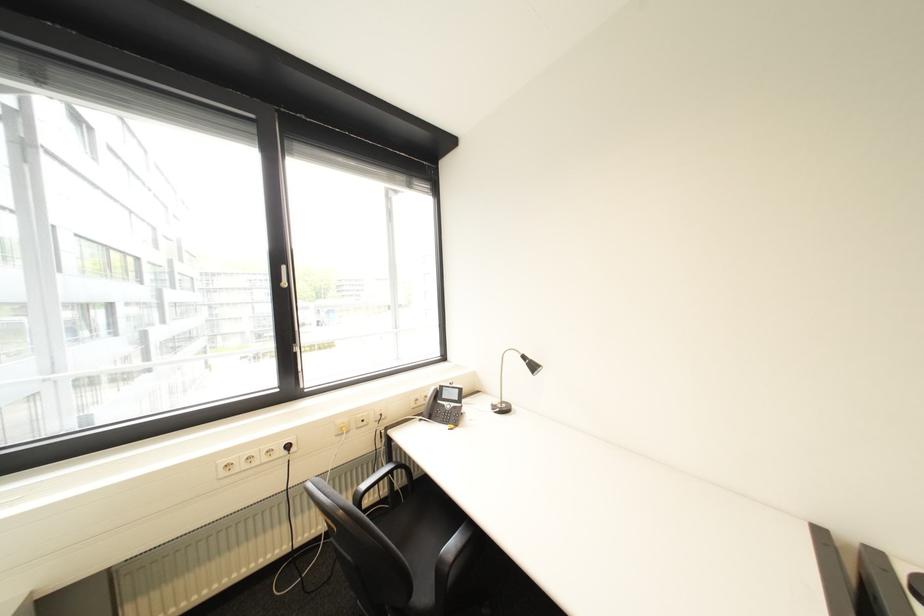
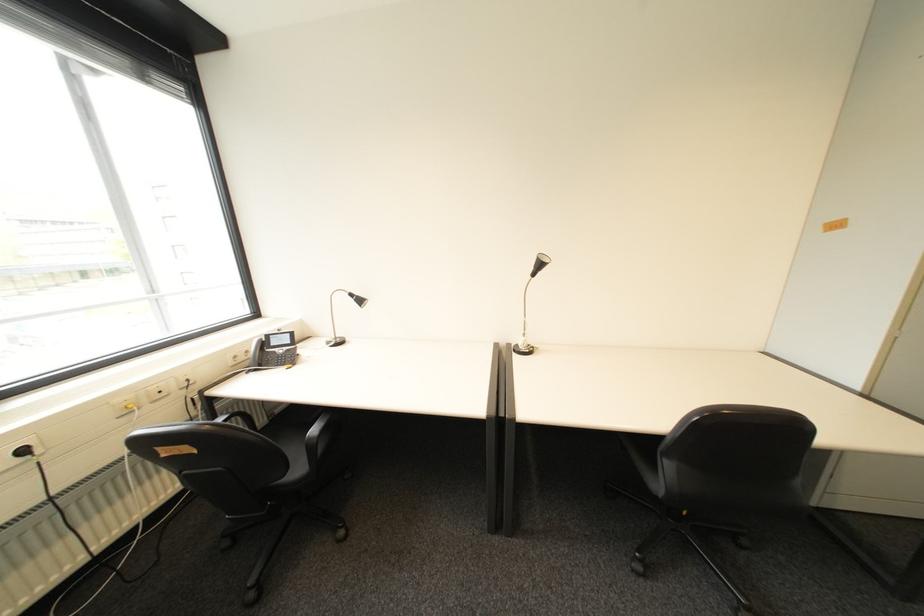
The point at (454, 398) is marked in the first image. Where is the corresponding point in the second image?

(283, 345)